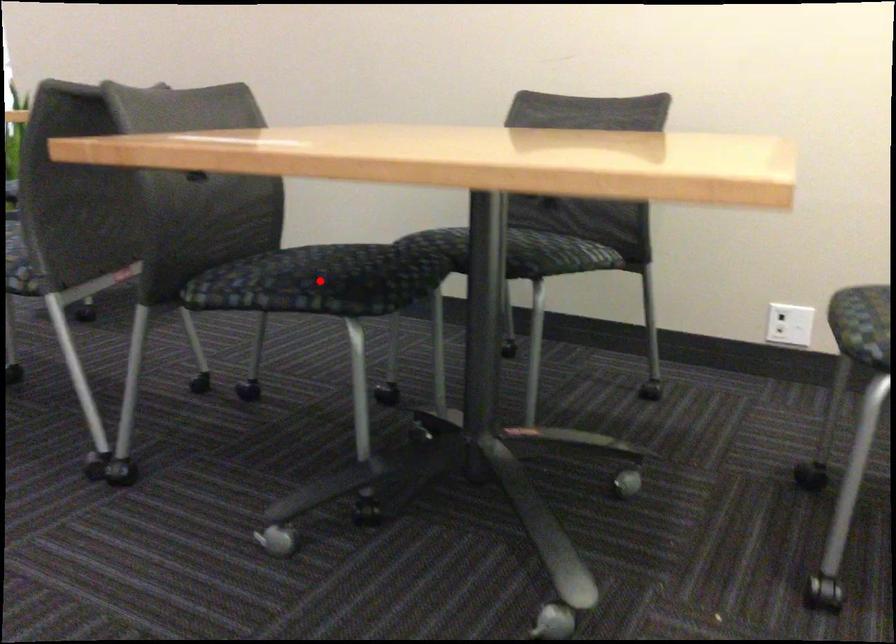
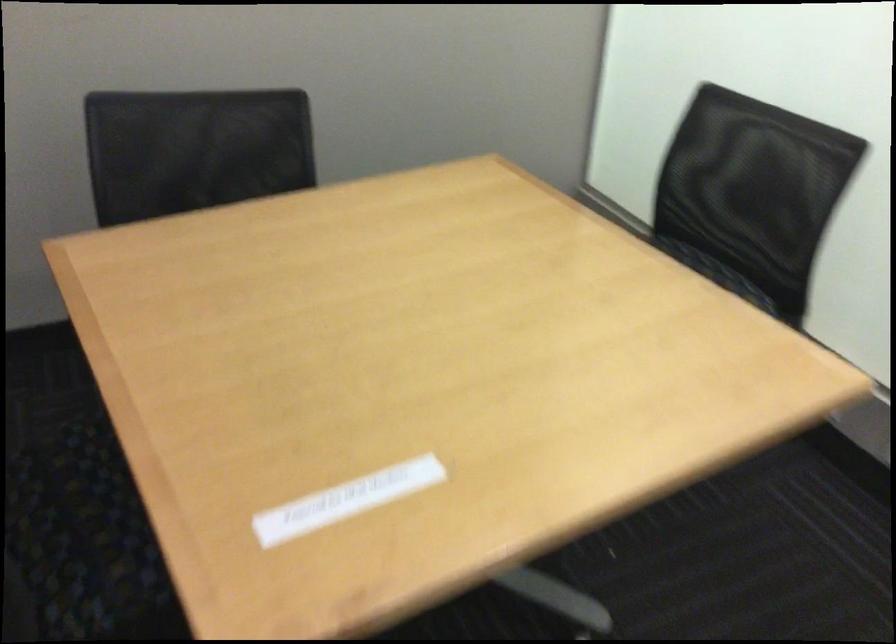
Question: I am providing you with two images of the same scene from different viewpoints. A red point is marked on the first image. Can you still see the location of the red point in image 2?

Choices:
 (A) Yes
 (B) No

Answer: (B)